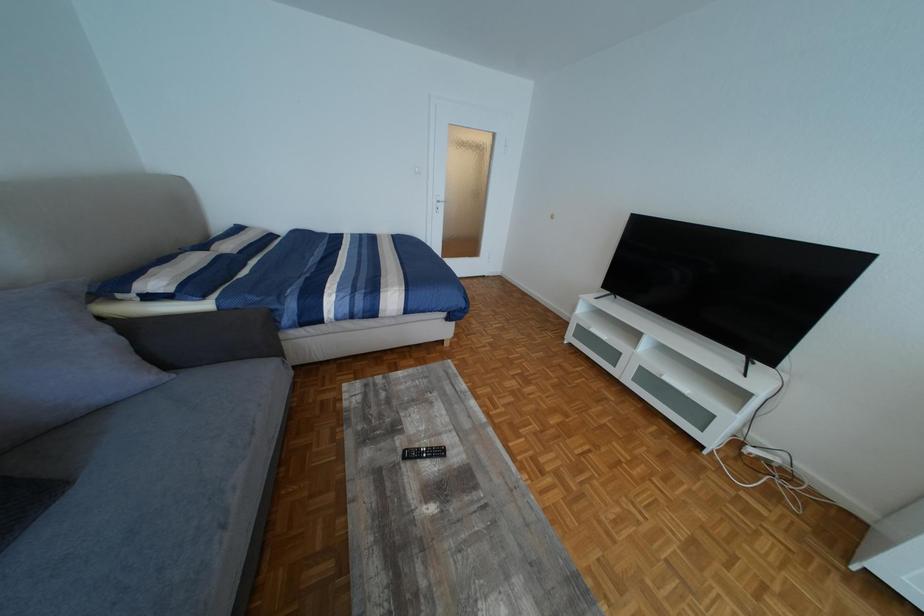
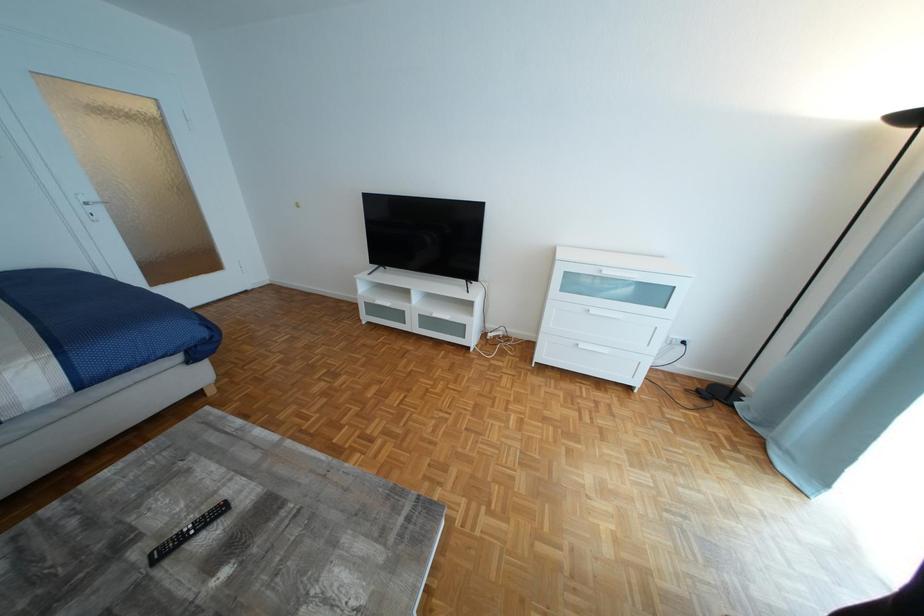
Question: Based on the continuous images, in which direction is the camera rotating? Reply with the corresponding letter.

Choices:
 (A) Left
 (B) Right
 (C) Up
 (D) Down

Answer: (B)